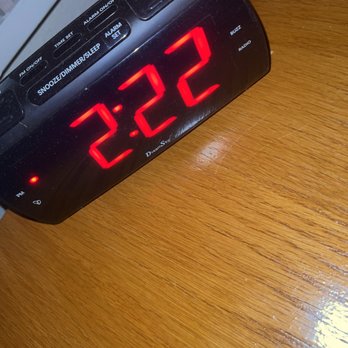
Find the location of a particular element. alarm on/off button is located at coordinates (100, 13).